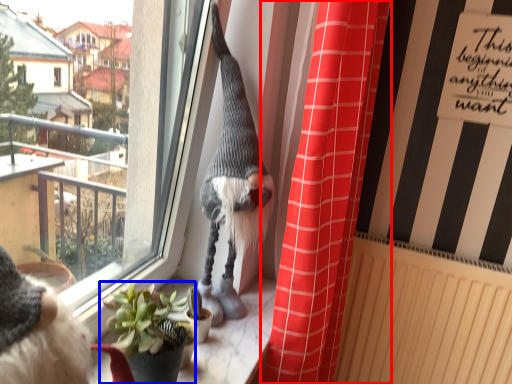
Question: Which of the following is the farthest to the observer, curtain (highlighted by a red box) or houseplant (highlighted by a blue box)?

Choices:
 (A) curtain
 (B) houseplant

Answer: (A)